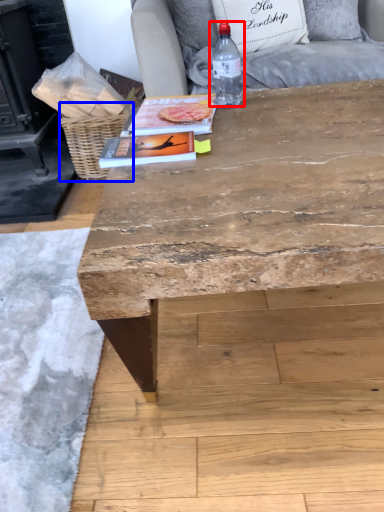
Question: Which point is closer to the camera, bottle (highlighted by a red box) or basket (highlighted by a blue box)?

Choices:
 (A) bottle
 (B) basket

Answer: (A)